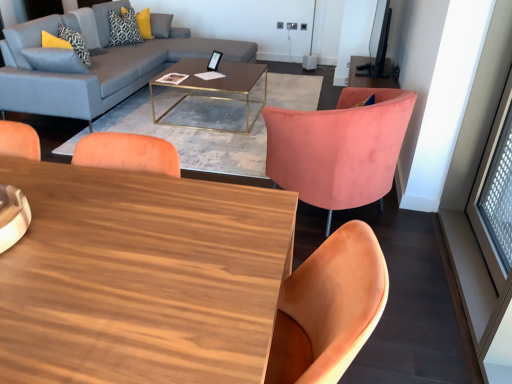
Find the location of a particular element. vacant space in front of metallic gold coffee table at center, the first coffee table positioned from the back is located at coordinates point(205,139).